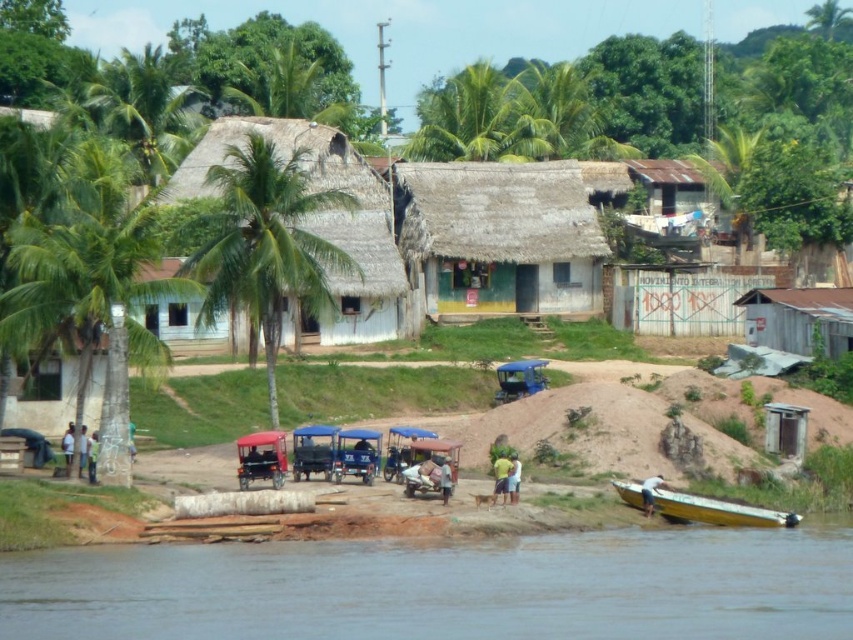
Between green leafy palm tree at center and white fabric shirt at lower center, which one has more height?

green leafy palm tree at center is taller.

Can you confirm if green leafy palm tree at center is positioned above white fabric shirt at lower center?

Yes.

Between point (247, 253) and point (519, 477), which one is positioned in front?

Positioned in front is point (519, 477).

Identify the location of green leafy palm tree at center. (264, 243).

Is point (839, 342) less distant than point (704, 198)?

Yes.

At what (x,y) coordinates should I click in order to perform the action: click on brown corrugated metal hut at lower right. Please return your answer as a coordinate pair (x, y). The height and width of the screenshot is (640, 853). Looking at the image, I should click on (798, 317).

Where is `brown corrugated metal hut at lower right`? The image size is (853, 640). brown corrugated metal hut at lower right is located at coordinates (798, 317).

Is green leafy palm tree at left positioned in front of light blue fabric boat at lower right?

No.

What do you see at coordinates (91, 294) in the screenshot? I see `green leafy palm tree at left` at bounding box center [91, 294].

Locate an element on the screen. This screenshot has height=640, width=853. green leafy palm tree at left is located at coordinates (91, 294).